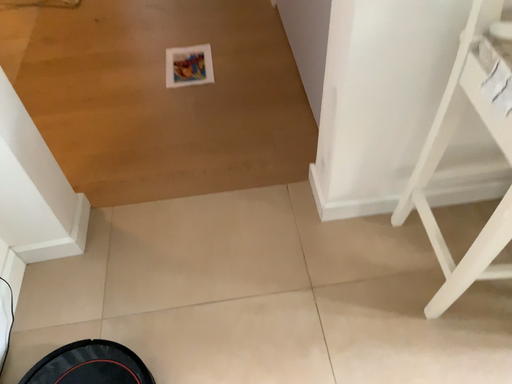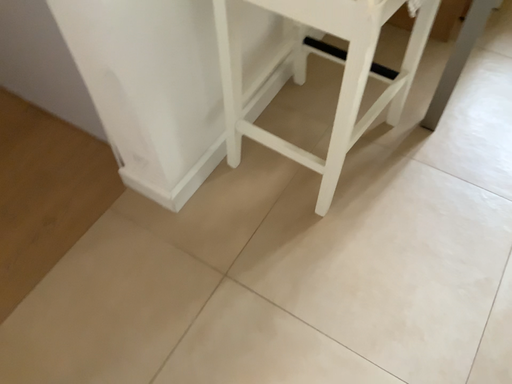
Question: How did the camera likely rotate when shooting the video?

Choices:
 (A) rotated right
 (B) rotated left

Answer: (A)